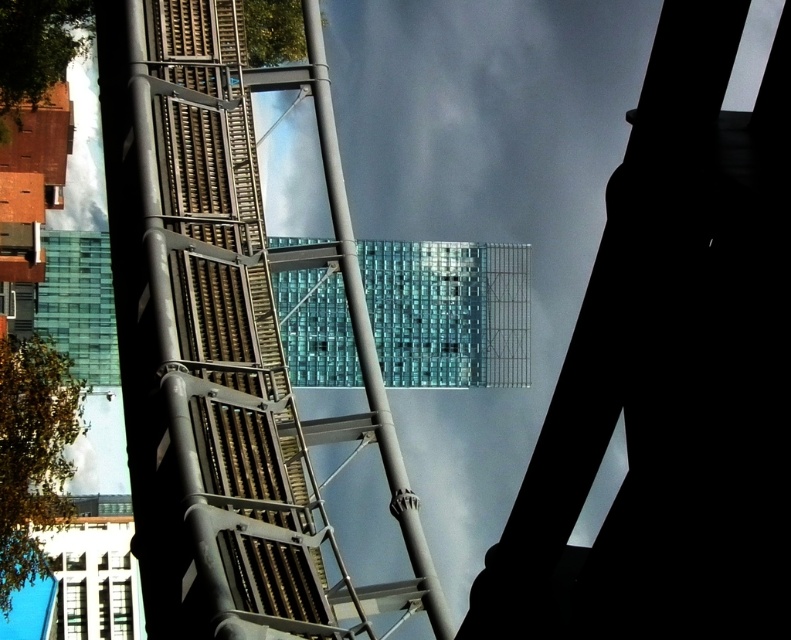
Question: Which object appears farthest from the camera in this image?

Choices:
 (A) translucent glass tower at center
 (B) metallic gray pole at center

Answer: (B)

Question: Does translucent glass tower at center appear on the right side of metallic gray pole at center?

Choices:
 (A) no
 (B) yes

Answer: (A)

Question: Does translucent glass tower at center appear under metallic gray pole at center?

Choices:
 (A) no
 (B) yes

Answer: (B)

Question: Can you confirm if translucent glass tower at center is bigger than metallic gray pole at center?

Choices:
 (A) yes
 (B) no

Answer: (A)